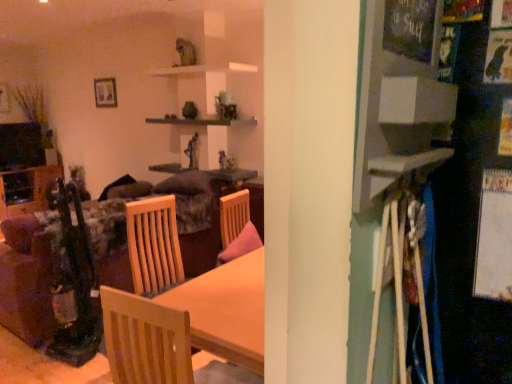
What is the approximate width of light wood chair at center?

20.69 inches.

Identify the location of velvet floral couch at left. This screenshot has width=512, height=384. (29, 275).

The height and width of the screenshot is (384, 512). Identify the location of wooden shelf at left. (31, 189).

Considering the sizes of objects light wood chair at center and wooden table at center in the image provided, who is smaller, light wood chair at center or wooden table at center?

Smaller between the two is wooden table at center.

Where is `table above the light wood chair at center (from a real-world perspective)`? Image resolution: width=512 pixels, height=384 pixels. table above the light wood chair at center (from a real-world perspective) is located at coordinates (232, 176).

Which object is further away from the camera taking this photo, light wood chair at center or wooden table at center?

wooden table at center is more distant.

Who is shorter, light wood chair at center or wooden table at center?

Standing shorter between the two is wooden table at center.

Is velvet floral couch at left located outside wooden table at center?

Yes.

Based on their positions, is velvet floral couch at left located to the left or right of wooden table at center?

Based on their positions, velvet floral couch at left is located to the left of wooden table at center.

Is velvet floral couch at left beside light wood chair at center?

No, velvet floral couch at left is not beside light wood chair at center.

In the scene shown: From the image's perspective, is velvet floral couch at left under light wood chair at center?

Actually, velvet floral couch at left appears above light wood chair at center in the image.

In the scene shown: From a real-world perspective, is velvet floral couch at left under light wood chair at center?

Indeed, from a real-world perspective, velvet floral couch at left is positioned beneath light wood chair at center.

From the image's perspective, which object appears higher, wooden picture frame at upper left or wooden table at center?

From the image's view, wooden picture frame at upper left is above.

Is wooden picture frame at upper left far away from wooden table at center?

Absolutely, wooden picture frame at upper left is distant from wooden table at center.

Which is further, (108, 85) or (223, 172)?

The point (108, 85) is farther.

Looking at this image, from a real-world perspective, is wooden picture frame at upper left on top of velvet floral couch at left?

Correct, in the physical world, wooden picture frame at upper left is higher than velvet floral couch at left.

Is wooden picture frame at upper left behind velvet floral couch at left?

Yes.

Considering the sizes of objects wooden picture frame at upper left and velvet floral couch at left in the image provided, who is shorter, wooden picture frame at upper left or velvet floral couch at left?

With less height is wooden picture frame at upper left.

Are wooden picture frame at upper left and velvet floral couch at left beside each other?

They are not placed beside each other.

Considering the positions of objects wooden table at center and wooden picture frame at upper left in the image provided, who is more to the left, wooden table at center or wooden picture frame at upper left?

wooden picture frame at upper left is more to the left.

Based on the photo, is wooden table at center far away from wooden picture frame at upper left?

Yes, wooden table at center and wooden picture frame at upper left are quite far apart.

Does wooden table at center turn towards wooden picture frame at upper left?

No, wooden table at center is not facing towards wooden picture frame at upper left.

Considering the positions of points (226, 172) and (115, 98), is point (226, 172) farther from camera compared to point (115, 98)?

No, (226, 172) is in front of (115, 98).

Is wooden table at center at the right side of light wood chair at center?

Incorrect, wooden table at center is not on the right side of light wood chair at center.

Does wooden table at center have a greater height compared to light wood chair at center?

No, wooden table at center is not taller than light wood chair at center.

Is the surface of wooden table at center in direct contact with light wood chair at center?

They are not placed beside each other.

Identify the location of table above the light wood chair at center (from the image's perspective). Image resolution: width=512 pixels, height=384 pixels. (232, 176).

This screenshot has width=512, height=384. Find the location of `couch below the wooden table at center (from a real-world perspective)`. couch below the wooden table at center (from a real-world perspective) is located at coordinates (29, 275).

Considering their positions, is wooden table at center positioned further to wooden picture frame at upper left than velvet floral couch at left?

The object further to wooden picture frame at upper left is velvet floral couch at left.

Considering their positions, is wooden picture frame at upper left positioned closer to light wood chair at center than wooden table at center?

wooden table at center is positioned closer to the anchor light wood chair at center.

Which object lies further to the anchor point wooden table at center, velvet floral couch at left or light wood chair at center?

light wood chair at center is further to wooden table at center.

Estimate the real-world distances between objects in this image. Which object is closer to velvet floral couch at left, wooden picture frame at upper left or wooden table at center?

The object closer to velvet floral couch at left is wooden table at center.

When comparing their distances from velvet floral couch at left, does wooden shelf at left or wooden table at center seem further?

wooden table at center lies further to velvet floral couch at left than the other object.

Which object lies nearer to the anchor point wooden table at center, velvet floral couch at left or wooden shelf at left?

Among the two, velvet floral couch at left is located nearer to wooden table at center.

Estimate the real-world distances between objects in this image. Which object is closer to wooden picture frame at upper left, velvet floral couch at left or wooden table at center?

Based on the image, wooden table at center appears to be nearer to wooden picture frame at upper left.

Which object lies nearer to the anchor point wooden shelf at left, light wood chair at center or velvet floral couch at left?

Among the two, velvet floral couch at left is located nearer to wooden shelf at left.

This screenshot has height=384, width=512. Find the location of `picture frame between wooden shelf at left and wooden table at center`. picture frame between wooden shelf at left and wooden table at center is located at coordinates (105, 93).

The width and height of the screenshot is (512, 384). Identify the location of couch located between light wood chair at center and wooden shelf at left in the depth direction. (29, 275).

Identify the location of couch between light wood chair at center and wooden picture frame at upper left in the front-back direction. (29, 275).

Locate an element on the screen. This screenshot has width=512, height=384. picture frame between light wood chair at center and wooden shelf at left along the z-axis is located at coordinates (105, 93).